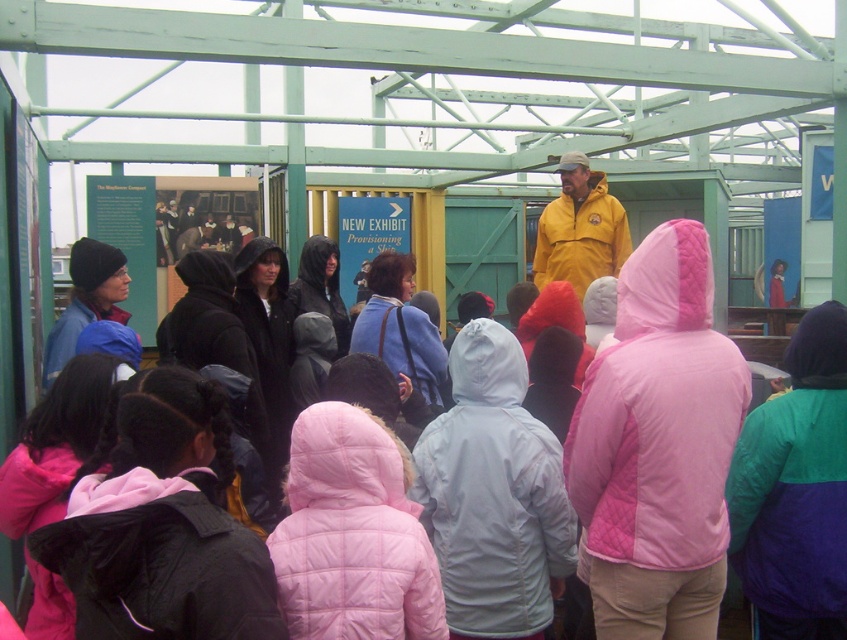
Question: Which of these objects is positioned closest to the yellow matte jacket at center?

Choices:
 (A) matte blue jacket at left
 (B) black quilted jacket at center

Answer: (B)

Question: Is light gray quilted jacket at center positioned behind black quilted jacket at center?

Choices:
 (A) yes
 (B) no

Answer: (B)

Question: Which of the following is the closest to the observer?

Choices:
 (A) (591, 250)
 (B) (401, 563)
 (C) (75, 294)

Answer: (B)

Question: Is pink quilted jacket at center in front of blue quilted jacket at center?

Choices:
 (A) yes
 (B) no

Answer: (A)

Question: Based on their relative distances, which object is farther from the matte black jacket at lower left?

Choices:
 (A) black quilted jacket at center
 (B) pink quilted jacket at center
 (C) blue quilted jacket at center
 (D) light gray quilted jacket at center

Answer: (C)

Question: Is black quilted jacket at center to the right of yellow matte jacket at center from the viewer's perspective?

Choices:
 (A) no
 (B) yes

Answer: (A)